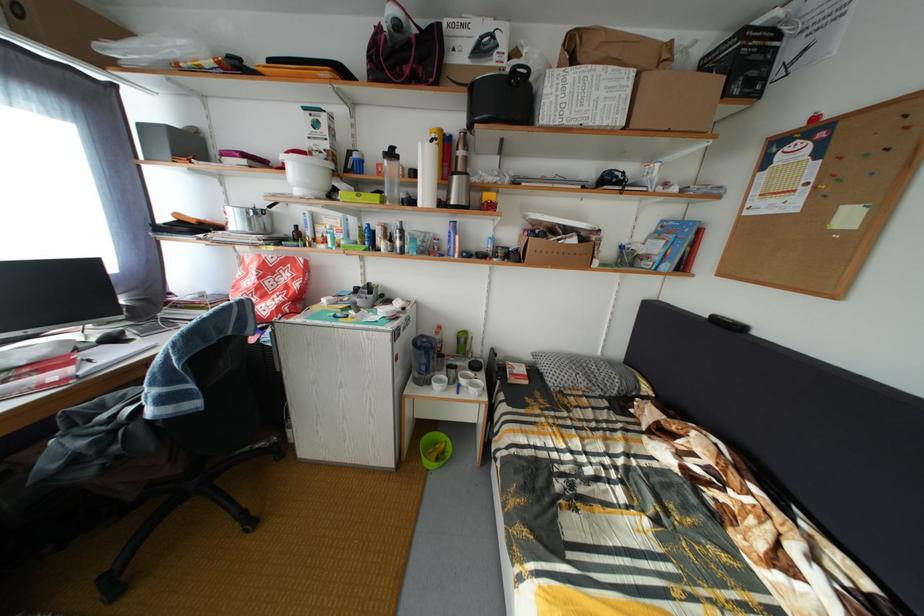
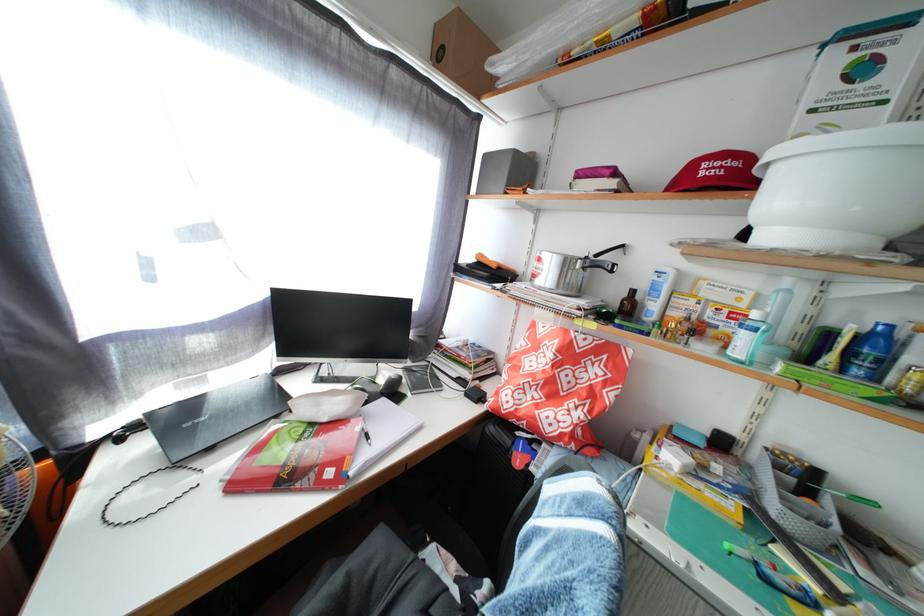
The point at (278, 214) is marked in the first image. Where is the corresponding point in the second image?

(605, 262)